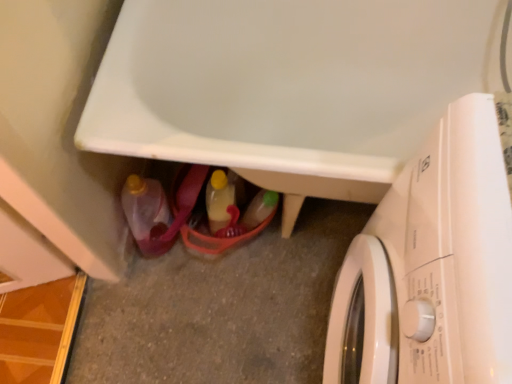
Where is `free space in front of matte plastic bottle at lower left, which is the 1th bottle in left-to-right order`? This screenshot has width=512, height=384. free space in front of matte plastic bottle at lower left, which is the 1th bottle in left-to-right order is located at coordinates (147, 299).